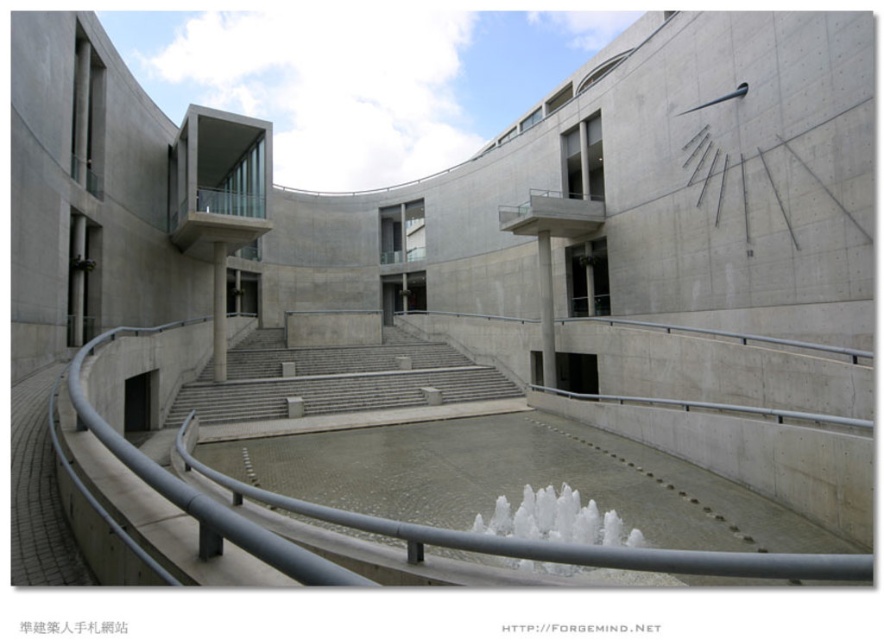
Based on the photo, between gray concrete stairs at center and white frothy water at center, which one is positioned higher?

gray concrete stairs at center

Can you confirm if gray concrete stairs at center is bigger than white frothy water at center?

Yes.

Between point (428, 380) and point (552, 490), which one is positioned behind?

Positioned behind is point (428, 380).

Identify the location of gray concrete stairs at center. This screenshot has width=884, height=640. (334, 380).

Is silver metallic rail at lower center to the right of gray concrete stairs at center from the viewer's perspective?

Indeed, silver metallic rail at lower center is positioned on the right side of gray concrete stairs at center.

Who is positioned more to the right, silver metallic rail at lower center or gray concrete stairs at center?

silver metallic rail at lower center is more to the right.

Who is more distant from viewer, (382, 524) or (435, 342)?

Positioned behind is point (435, 342).

Where is `silver metallic rail at lower center`? The height and width of the screenshot is (640, 884). silver metallic rail at lower center is located at coordinates (562, 544).

What do you see at coordinates (562, 544) in the screenshot?
I see `silver metallic rail at lower center` at bounding box center [562, 544].

Between point (303, 579) and point (496, 525), which one is positioned behind?

The point (496, 525) is behind.

Measure the distance between point [290,563] and camera.

Point [290,563] and camera are 2.23 meters apart.

Image resolution: width=884 pixels, height=640 pixels. What are the coordinates of `silver metallic rail at lower center` in the screenshot? It's located at (562, 544).